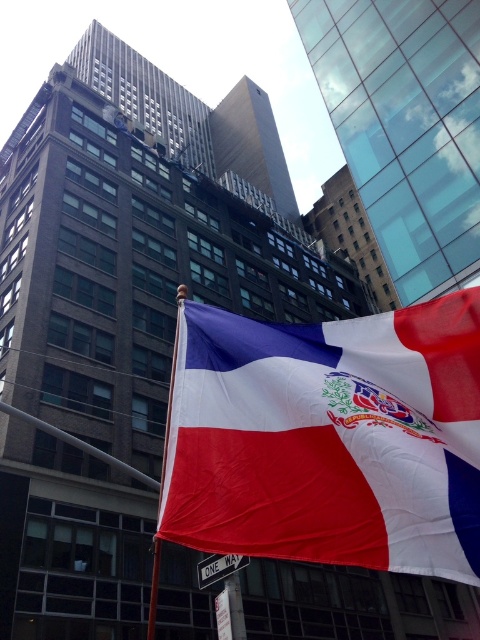
Can you confirm if textured fabric flag at center is thinner than metallic flag pole at center?

Yes.

At what (x,y) coordinates should I click in order to perform the action: click on textured fabric flag at center. Please return your answer as a coordinate pair (x, y). Looking at the image, I should click on (328, 438).